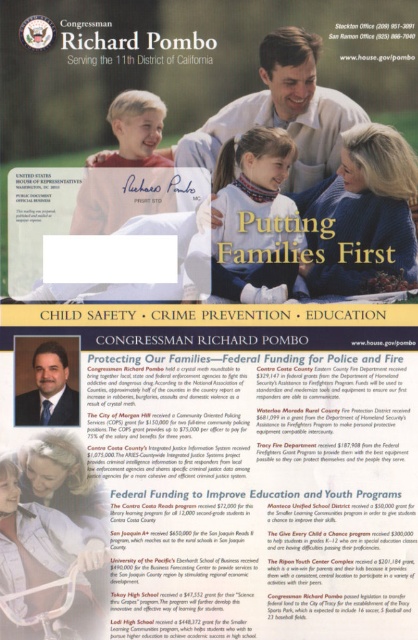
Question: Among these points, which one is farthest from the camera?

Choices:
 (A) (252, 198)
 (B) (58, 404)

Answer: (A)

Question: Which of the following is the closest to the observer?

Choices:
 (A) light blue fabric at center
 (B) blue suit at center

Answer: (A)

Question: Does light blue fabric at center appear under blue suit at center?

Choices:
 (A) yes
 (B) no

Answer: (B)

Question: Which point is farther to the camera?

Choices:
 (A) (295, 154)
 (B) (61, 388)

Answer: (A)

Question: Is light blue fabric at center further to camera compared to blue suit at center?

Choices:
 (A) no
 (B) yes

Answer: (A)

Question: Is light blue fabric at center wider than blue suit at center?

Choices:
 (A) yes
 (B) no

Answer: (A)